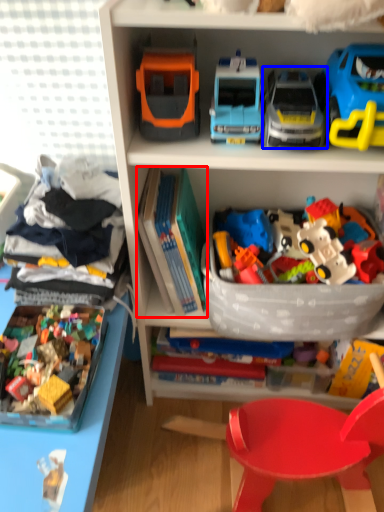
Question: Among these objects, which one is nearest to the camera, book (highlighted by a red box) or toy (highlighted by a blue box)?

Choices:
 (A) book
 (B) toy

Answer: (B)